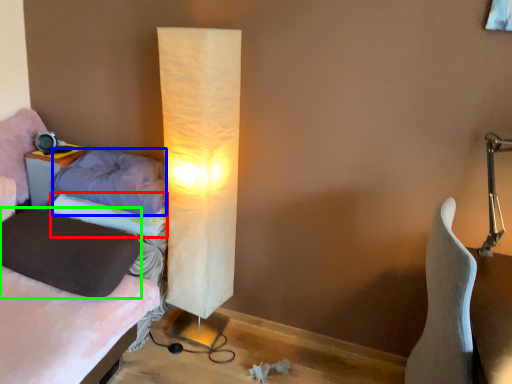
Question: Considering the real-world distances, which object is closest to pillow (highlighted by a red box)? pillow (highlighted by a blue box) or pillow (highlighted by a green box).

Choices:
 (A) pillow
 (B) pillow

Answer: (A)